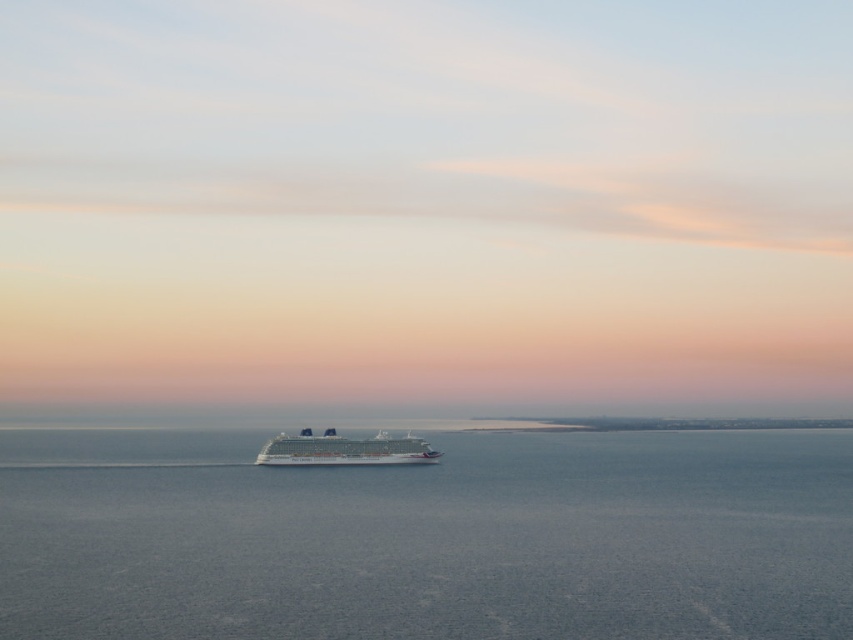
Question: Which of the following is the farthest from the observer?

Choices:
 (A) white glossy cruise ship at center
 (B) blue water at center

Answer: (A)

Question: Is blue water at center above white glossy cruise ship at center?

Choices:
 (A) no
 (B) yes

Answer: (A)

Question: Is blue water at center positioned at the back of white glossy cruise ship at center?

Choices:
 (A) yes
 (B) no

Answer: (B)

Question: Which of the following is the farthest from the observer?

Choices:
 (A) blue water at center
 (B) white glossy cruise ship at center

Answer: (B)

Question: Which of the following is the farthest from the observer?

Choices:
 (A) blue water at center
 (B) white glossy cruise ship at center

Answer: (B)

Question: Can you confirm if blue water at center is positioned to the left of white glossy cruise ship at center?

Choices:
 (A) no
 (B) yes

Answer: (A)